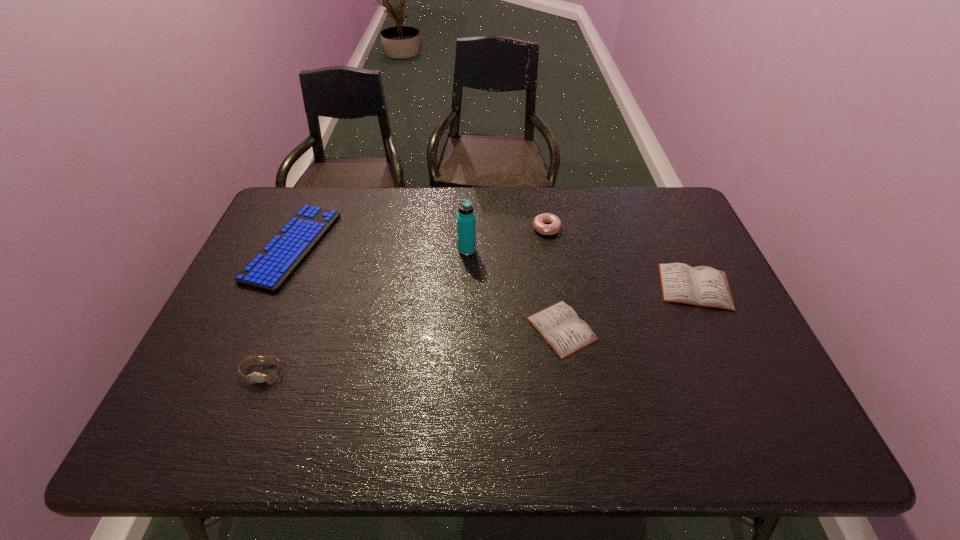
What are the coordinates of `object that is positioned at the far left corner` in the screenshot? It's located at (273, 266).

Identify the location of object that is at the near left corner. (256, 377).

In the image, there is a desktop. At what (x,y) coordinates should I click in order to perform the action: click on free space at the far edge. Please return your answer as a coordinate pair (x, y). The height and width of the screenshot is (540, 960). Looking at the image, I should click on (418, 208).

In the image, there is a desktop. Where is `vacant space at the near edge`? vacant space at the near edge is located at coordinates tap(617, 374).

I want to click on vacant space at the right edge, so click(728, 369).

Where is `vacant space at the far left corner`? The image size is (960, 540). vacant space at the far left corner is located at coordinates (297, 189).

In the image, there is a desktop. What are the coordinates of `vacant space at the near left corner` in the screenshot? It's located at (248, 406).

Where is `vacant space at the far right corner of the desktop`? The width and height of the screenshot is (960, 540). vacant space at the far right corner of the desktop is located at coordinates pos(664,189).

I want to click on vacant region at the near right corner of the desktop, so click(x=783, y=402).

Locate an element on the screen. free point between the fourth object from right to left and the computer keyboard is located at coordinates (380, 248).